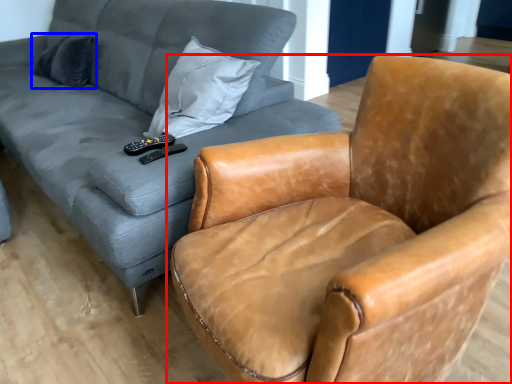
Question: Among these objects, which one is farthest to the camera, chair (highlighted by a red box) or pillow (highlighted by a blue box)?

Choices:
 (A) chair
 (B) pillow

Answer: (B)